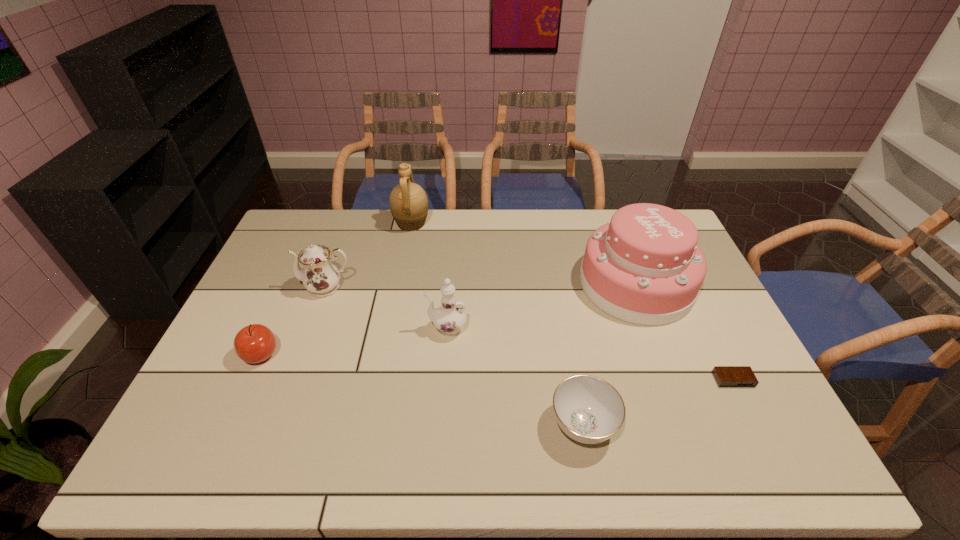
Where is `pitcher positioned at the far edge`? The height and width of the screenshot is (540, 960). pitcher positioned at the far edge is located at coordinates (408, 202).

You are a GUI agent. You are given a task and a screenshot of the screen. Output one action in this format:
    pyautogui.click(x=<x>, y=<y>)
    Task: Click on the birthday cake that is positioned at the far edge
    Image resolution: width=960 pixels, height=540 pixels.
    Given the screenshot: What is the action you would take?
    (644, 267)

Find the location of a particular element. This screenshot has height=540, width=960. object positioned at the near edge is located at coordinates (588, 409).

At what (x,y) coordinates should I click in order to perform the action: click on chinaware that is at the left edge. Please return your answer as a coordinate pair (x, y). This screenshot has width=960, height=540. Looking at the image, I should click on [x=319, y=276].

Locate an element on the screen. This screenshot has height=540, width=960. apple located at the left edge is located at coordinates (255, 343).

What are the coordinates of `birthday cake located at the right edge` in the screenshot? It's located at pyautogui.click(x=644, y=267).

The width and height of the screenshot is (960, 540). In order to click on alarm clock at the right edge in this screenshot , I will do `click(726, 376)`.

Find the location of a particular element. This screenshot has height=540, width=960. object located in the far right corner section of the desktop is located at coordinates (644, 267).

The height and width of the screenshot is (540, 960). In order to click on vacant point at the far edge in this screenshot , I will do `click(547, 222)`.

The height and width of the screenshot is (540, 960). Identify the location of vacant position at the near edge of the desktop. (424, 441).